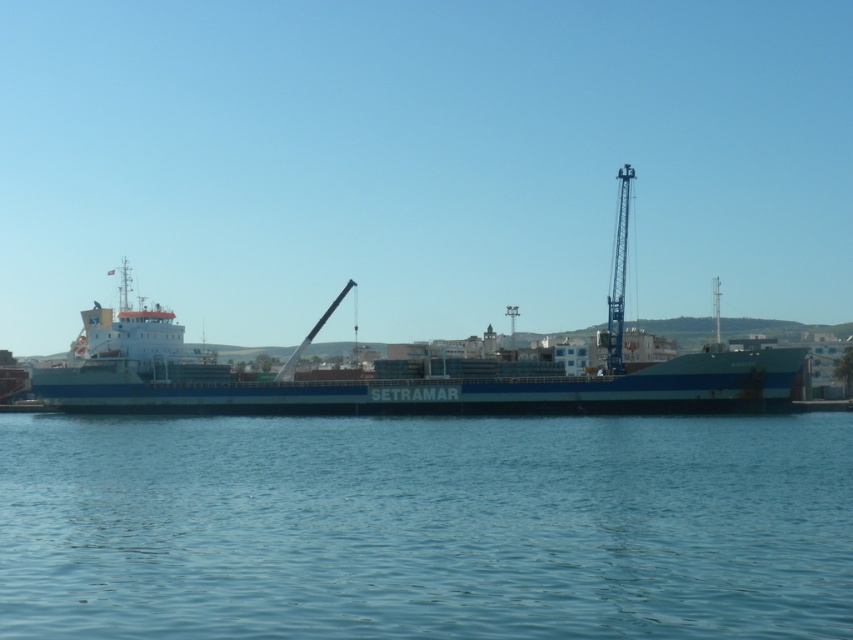
You are standing on the deck of the SETRAMAR cargo ship and looking towards the point marked as point (425,525). What do you see at that location?

At point (425,525), you see blue liquid water at center.

You are standing on the deck of the SETRAMAR cargo ship and want to move from point A to point B. Point A is at coordinate point (430, 502) and point B is at coordinate point (804, 353). Which point is closer to you when you start at point A?

Point A at coordinate point (430, 502) is closer to you since it is your starting position, while point B at coordinate point (804, 353) is farther away.